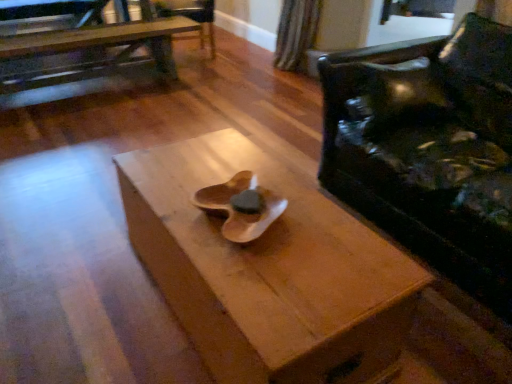
You are a GUI agent. You are given a task and a screenshot of the screen. Output one action in this format:
    pyautogui.click(x=<x>, y=<y>)
    Task: Click on the vacant area that is in front of wooden table at upper left, the 2th table viewed from the right
    The width and height of the screenshot is (512, 384).
    Given the screenshot: What is the action you would take?
    pyautogui.click(x=70, y=141)